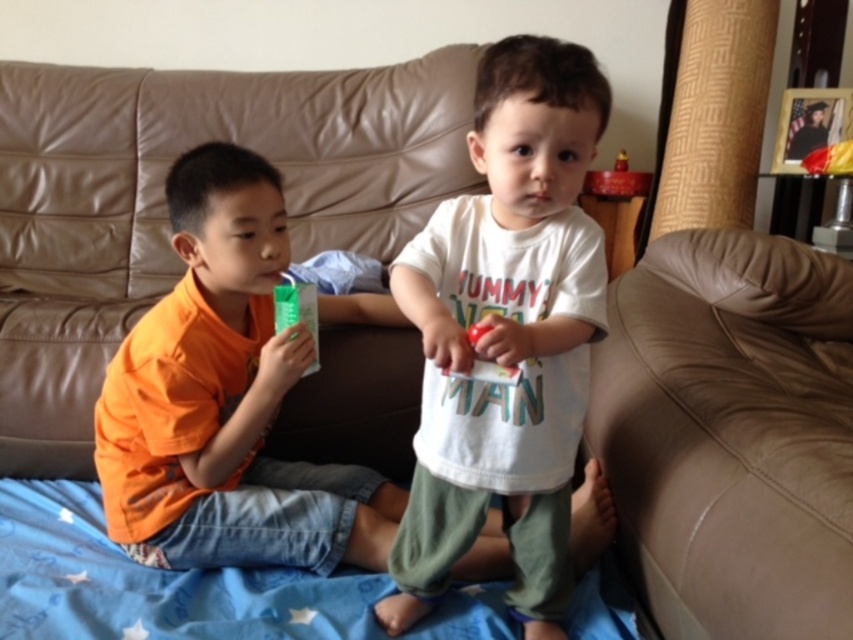
You are a parent trying to hand a small toy to your child. The toy is currently on the wooden side table. You need to decide whether to hand it to the child wearing the white cotton shirt at center or the orange cotton shirt at left based on their proximity. Which child is closer to the wooden side table?

The white cotton shirt at center is closer to the wooden side table than the orange cotton shirt at left because the distance between them is 16.19 inches.

You are a photographer standing in the living room. You want to take a photo of the white cotton shirt at center. Where should you position your camera to capture it in the frame?

The white cotton shirt at center is located at point coordinates (x=506, y=333), so you should position your camera to aim directly at those coordinates to capture it in the frame.